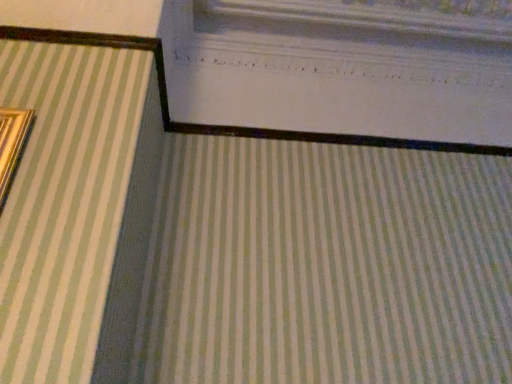
Locate an element on the screen. This screenshot has height=384, width=512. white painted wood at upper center is located at coordinates (338, 70).

Describe the element at coordinates (338, 70) in the screenshot. This screenshot has height=384, width=512. I see `white painted wood at upper center` at that location.

Find the location of a particular element. white painted wood at upper center is located at coordinates (338, 70).